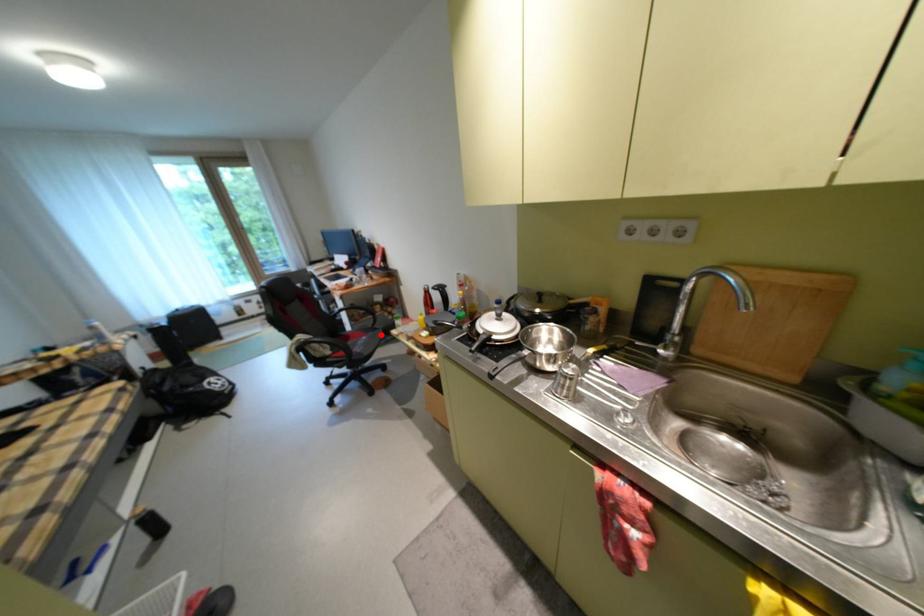
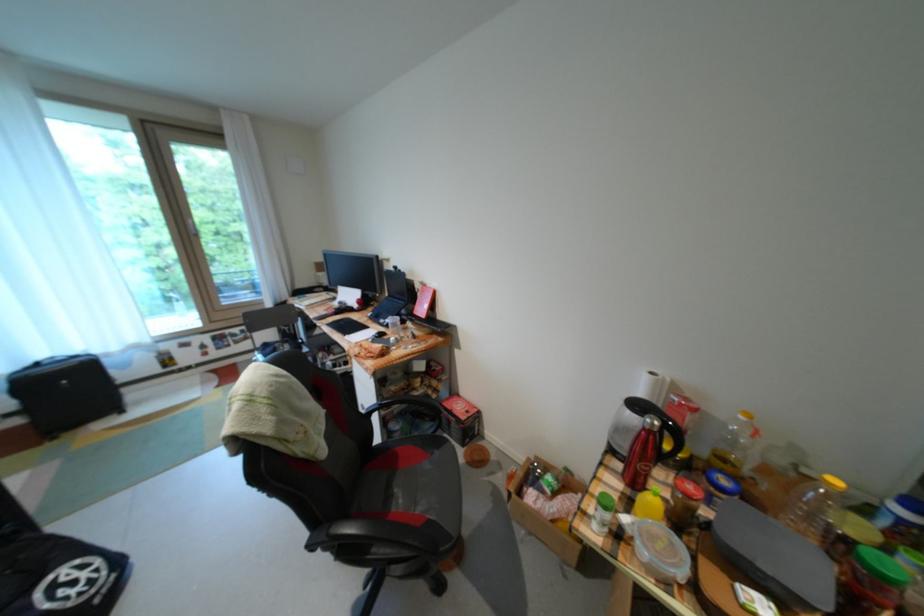
Question: I am providing you with two images of the same scene from different viewpoints. In image1, a red point is highlighted. Considering the same 3D point in image2, which of the following is correct?

Choices:
 (A) It is closer
 (B) It is farther

Answer: (A)